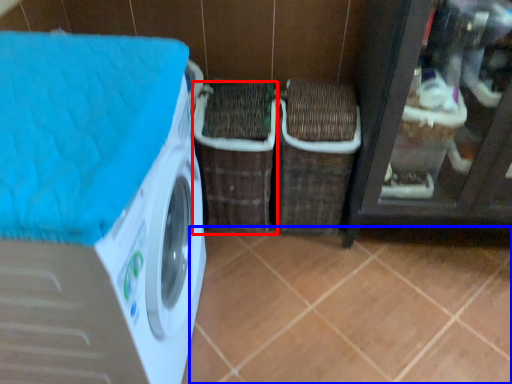
Question: Which object is closer to the camera taking this photo, basket (highlighted by a red box) or tile (highlighted by a blue box)?

Choices:
 (A) basket
 (B) tile

Answer: (B)